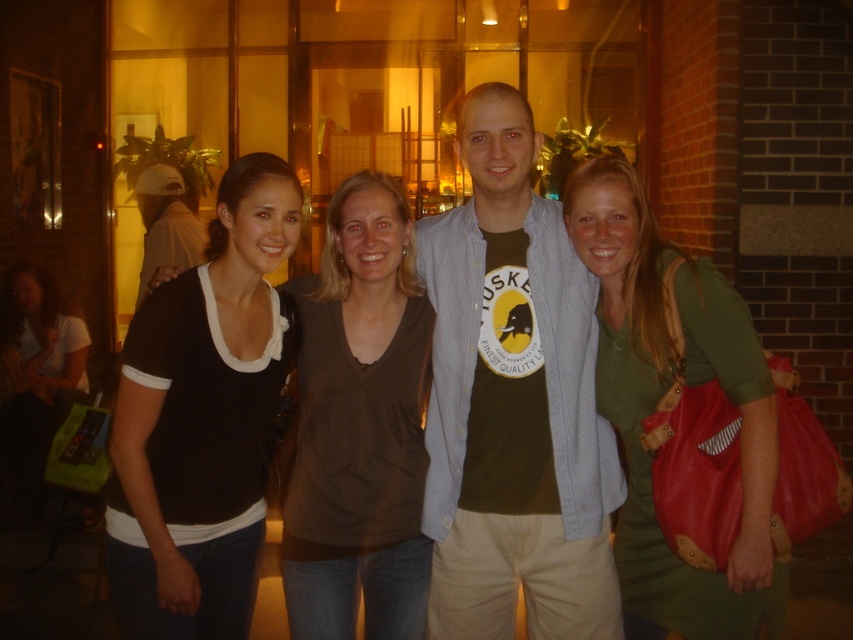
You are standing at the point with coordinates point (621, 289) and want to walk to the point with coordinates point (599, 561). Is there a clear path between these two points?

The point (599, 561) is behind point (621, 289), so there is no clear path between them as the destination point is obstructed by the starting point.

You are standing in front of the group of four people in the image. There are two points marked in the scene. Which point, point [473,534] or point [189,628], is closer to you?

Point [473,534] is closer to you because it is further to the viewer than point [189,628].